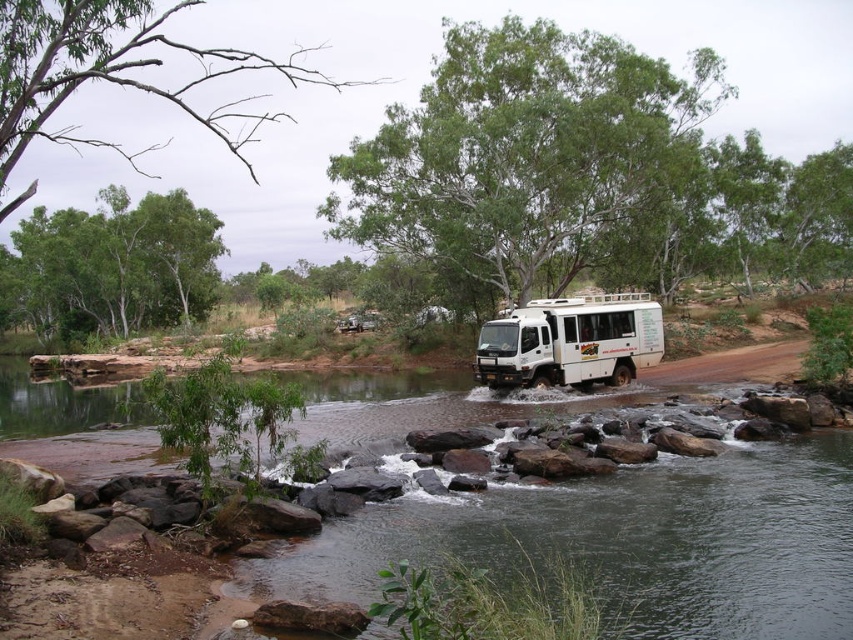
Can you confirm if green leafy tree at center is bigger than white matte camper at center?

Yes.

Is green leafy tree at center taller than white matte camper at center?

Correct, green leafy tree at center is much taller as white matte camper at center.

This screenshot has width=853, height=640. What do you see at coordinates (526, 154) in the screenshot?
I see `green leafy tree at center` at bounding box center [526, 154].

This screenshot has height=640, width=853. In order to click on green leafy tree at center in this screenshot , I will do `click(526, 154)`.

Which is more to the left, green leafy tree at center or dead wood branches at upper left?

dead wood branches at upper left is more to the left.

How far apart are green leafy tree at center and dead wood branches at upper left?

They are 76.13 feet apart.

Who is more forward, (515, 259) or (12, 170)?

Positioned in front is point (515, 259).

Where is `green leafy tree at center`? The image size is (853, 640). green leafy tree at center is located at coordinates (526, 154).

Can you confirm if green leafy tree at center is positioned to the left of green leafy tree at upper left?

Incorrect, green leafy tree at center is not on the left side of green leafy tree at upper left.

Image resolution: width=853 pixels, height=640 pixels. Find the location of `green leafy tree at center`. green leafy tree at center is located at coordinates (526, 154).